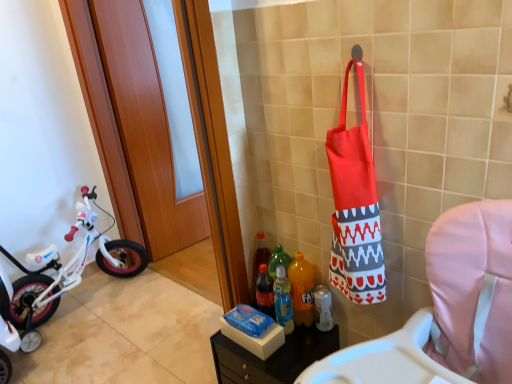
Locate an element on the screen. vacant space in front of orange plastic bottle at center, the second bottle in the right-to-left sequence is located at coordinates (301, 341).